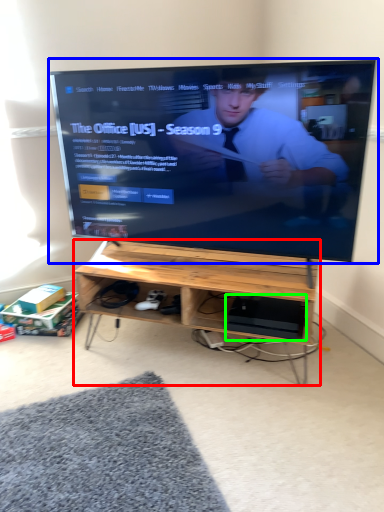
Question: Which object is positioned closest to desk (highlighted by a red box)? Select from television (highlighted by a blue box) and computer (highlighted by a green box).

Choices:
 (A) television
 (B) computer

Answer: (B)